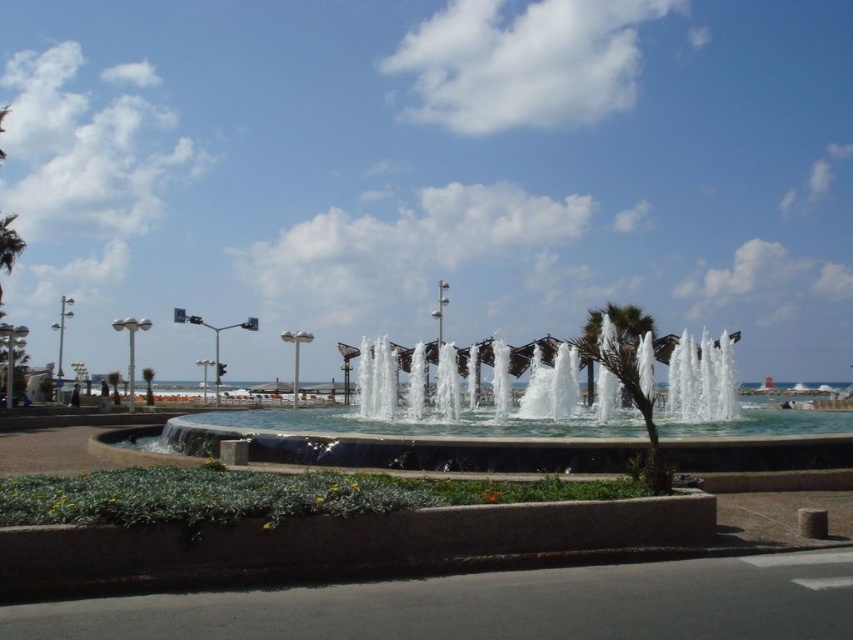
You are a landscape architect designing a new garden. You need to place a new bench between the concrete fountain at center and the green leafy palm tree at center. Based on their sizes, which object should the bench be closer to?

The bench should be placed closer to the green leafy palm tree at center because the concrete fountain at center is wider, requiring more space around it. Alternatively, if the bench needs to be equidistant, ensure there is enough space between both objects.

You are a visitor at the fountain area and want to take a photo of both the concrete fountain at center and the green leafy palm tree at center. Which object should you position to your left to capture both in the frame?

To capture both the concrete fountain at center and the green leafy palm tree at center in the frame, position the concrete fountain at center to your left since it is already to the left of the green leafy palm tree at center.